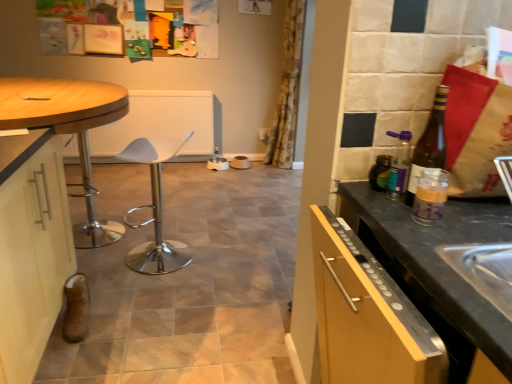
This screenshot has height=384, width=512. Find the location of `vacant space underneath white plastic bar stool at center (from a real-world perspective)`. vacant space underneath white plastic bar stool at center (from a real-world perspective) is located at coordinates (169, 260).